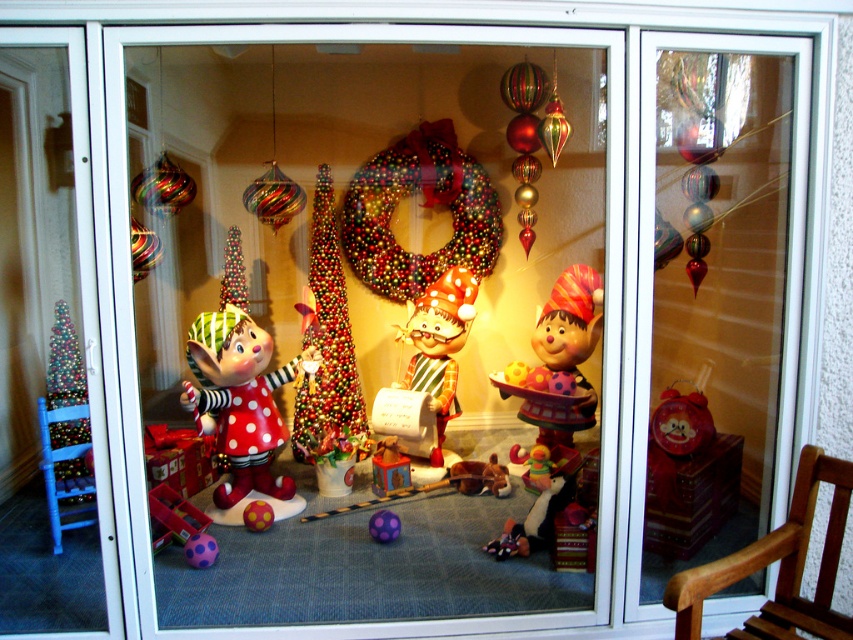
Question: Is wooden rocking chair at lower right above shiny metallic christmas tree at center?

Choices:
 (A) yes
 (B) no

Answer: (B)

Question: Which point is farther from the camera taking this photo?

Choices:
 (A) (845, 637)
 (B) (247, 451)
 (C) (688, 106)

Answer: (B)

Question: Which object is farther from the camera taking this photo?

Choices:
 (A) glossy fabric wreath at center
 (B) polka dot fabric elf at center
 (C) wooden rocking chair at lower right

Answer: (A)

Question: Does transparent glass door at center have a greater width compared to shiny metallic christmas tree at center?

Choices:
 (A) yes
 (B) no

Answer: (A)

Question: Which of these objects is positioned farthest from the shiny metallic christmas tree at center?

Choices:
 (A) wooden rocking chair at lower right
 (B) polka dot fabric elf at center
 (C) transparent glass door at center

Answer: (A)

Question: Can you confirm if glossy fabric wreath at center is bigger than wooden rocking chair at lower right?

Choices:
 (A) no
 (B) yes

Answer: (B)